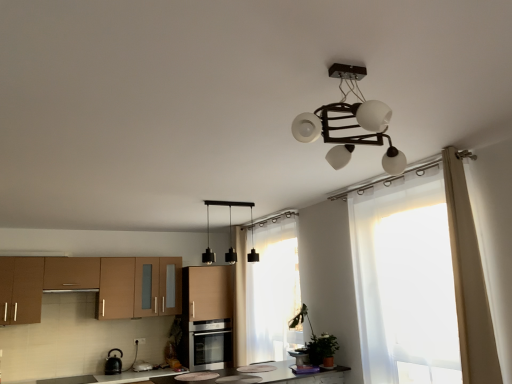
Question: Would you say sheer white curtain at center, marked as the first curtain in a back-to-front arrangement, contains matte black pot at center, the 2th appliance from the left?

Choices:
 (A) yes
 (B) no

Answer: (B)

Question: Is sheer white curtain at center, the second curtain from the right, looking in the opposite direction of matte black pot at center, the 2th appliance from the left?

Choices:
 (A) no
 (B) yes

Answer: (A)

Question: Can you confirm if sheer white curtain at center, marked as the first curtain in a back-to-front arrangement, is shorter than matte black pot at center, acting as the 1th appliance starting from the right?

Choices:
 (A) no
 (B) yes

Answer: (A)

Question: Is sheer white curtain at center, which is the second curtain from front to back, completely or partially outside of matte black pot at center, acting as the 1th appliance starting from the right?

Choices:
 (A) no
 (B) yes

Answer: (B)

Question: Does sheer white curtain at center, the 1th curtain positioned from the left, touch matte black pot at center, the 1th appliance positioned from the top?

Choices:
 (A) no
 (B) yes

Answer: (A)

Question: Is there a large distance between sheer white curtain at center, the 1th curtain positioned from the left, and matte black pot at center, the 1th appliance positioned from the top?

Choices:
 (A) no
 (B) yes

Answer: (A)

Question: From the image's perspective, is brown matte cabinet at left, the second cabinetry when ordered from right to left, on top of matte black pot at center, acting as the 2th appliance starting from the back?

Choices:
 (A) yes
 (B) no

Answer: (A)

Question: Can you confirm if brown matte cabinet at left, the second cabinetry when ordered from right to left, is taller than matte black pot at center, the 1th appliance positioned from the top?

Choices:
 (A) yes
 (B) no

Answer: (A)

Question: Considering the relative sizes of brown matte cabinet at left, the second cabinetry when ordered from right to left, and matte black pot at center, the 1th appliance positioned from the top, in the image provided, is brown matte cabinet at left, the second cabinetry when ordered from right to left, smaller than matte black pot at center, the 1th appliance positioned from the top,?

Choices:
 (A) no
 (B) yes

Answer: (A)

Question: Considering the relative positions of brown matte cabinet at left, the second cabinetry when ordered from right to left, and matte black pot at center, the 2th appliance from the left, in the image provided, is brown matte cabinet at left, the second cabinetry when ordered from right to left, to the left of matte black pot at center, the 2th appliance from the left, from the viewer's perspective?

Choices:
 (A) no
 (B) yes

Answer: (B)

Question: Are brown matte cabinet at left, the second cabinetry when ordered from right to left, and matte black pot at center, acting as the 2th appliance starting from the back, located far from each other?

Choices:
 (A) yes
 (B) no

Answer: (A)

Question: From a real-world perspective, is brown matte cabinet at left, which appears as the 1th cabinetry when viewed from the left, under matte black pot at center, the 2th appliance from the left?

Choices:
 (A) yes
 (B) no

Answer: (B)

Question: From a real-world perspective, is black matte pendant lights at center physically below sheer white curtain at center, the second curtain from the right?

Choices:
 (A) no
 (B) yes

Answer: (A)